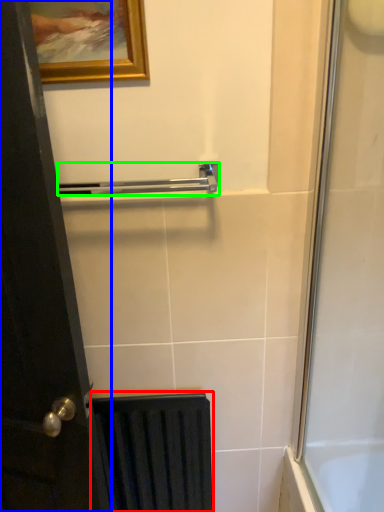
Question: Which object is the farthest from radiator (highlighted by a red box)? Choose among these: door (highlighted by a blue box) or towel bar (highlighted by a green box).

Choices:
 (A) door
 (B) towel bar

Answer: (B)